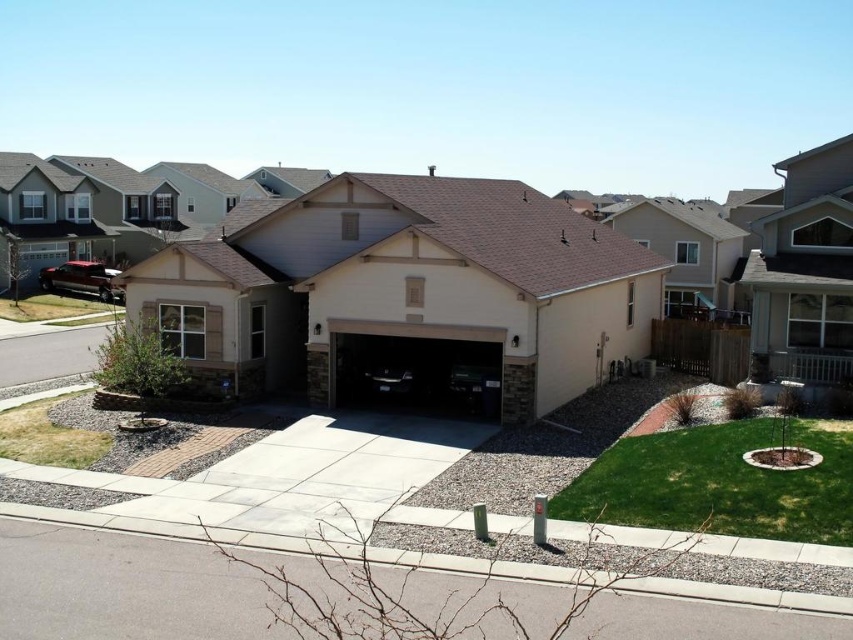
Who is positioned more to the right, beige stucco garage at center or gray concrete driveway at center?

Result: beige stucco garage at center is more to the right.

Does beige stucco garage at center have a lesser width compared to gray concrete driveway at center?

In fact, beige stucco garage at center might be wider than gray concrete driveway at center.

I want to click on beige stucco garage at center, so click(x=408, y=298).

How much distance is there between gray concrete driveway at center and matte black car at center?

gray concrete driveway at center is 46.83 feet away from matte black car at center.

Is gray concrete driveway at center to the right of matte black car at center from the viewer's perspective?

No, gray concrete driveway at center is not to the right of matte black car at center.

Does point (248, 604) lie in front of point (497, 342)?

Yes, it is.

Identify the location of gray concrete driveway at center. (122, 586).

Which is more to the left, beige stucco garage at center or matte black car at center?

matte black car at center is more to the left.

Can you confirm if beige stucco garage at center is positioned to the right of matte black car at center?

Correct, you'll find beige stucco garage at center to the right of matte black car at center.

Based on the photo, measure the distance between beige stucco garage at center and camera.

19.47 meters

At what (x,y) coordinates should I click in order to perform the action: click on beige stucco garage at center. Please return your answer as a coordinate pair (x, y). The width and height of the screenshot is (853, 640). Looking at the image, I should click on (408, 298).